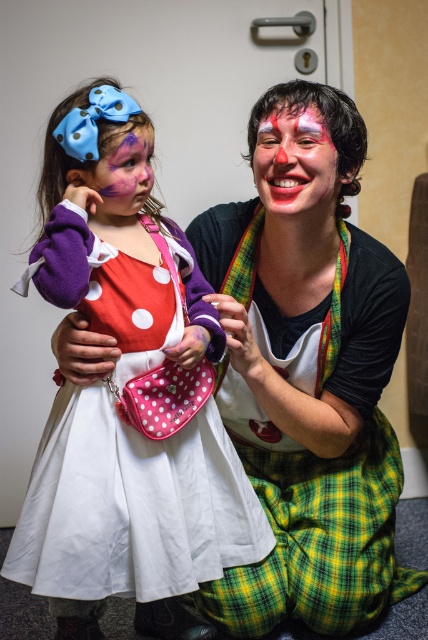
Where is `white polka dot dress at center`? The width and height of the screenshot is (428, 640). white polka dot dress at center is located at coordinates (125, 410).

The image size is (428, 640). I want to click on white polka dot dress at center, so click(x=125, y=410).

Who is more distant from viewer, (101, 134) or (284, 136)?

Point (284, 136)

Can you confirm if white polka dot dress at center is positioned above matte clown face at center?

Incorrect, white polka dot dress at center is not positioned above matte clown face at center.

At what (x,y) coordinates should I click in order to perform the action: click on white polka dot dress at center. Please return your answer as a coordinate pair (x, y). The height and width of the screenshot is (640, 428). Looking at the image, I should click on (125, 410).

Does matte clown face at center have a lesser width compared to matte purple face at center?

No, matte clown face at center is not thinner than matte purple face at center.

Does matte clown face at center have a lesser height compared to matte purple face at center?

No, matte clown face at center is not shorter than matte purple face at center.

Find the location of `matte clown face at center`. matte clown face at center is located at coordinates (296, 166).